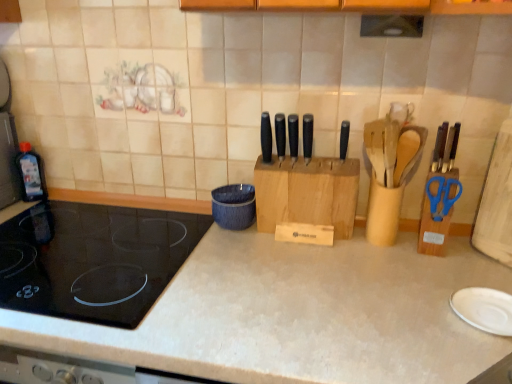
Locate an element on the screen. This screenshot has width=512, height=384. vacant space behind black matte knife at center, marked as the first knife in a right-to-left arrangement is located at coordinates (331, 155).